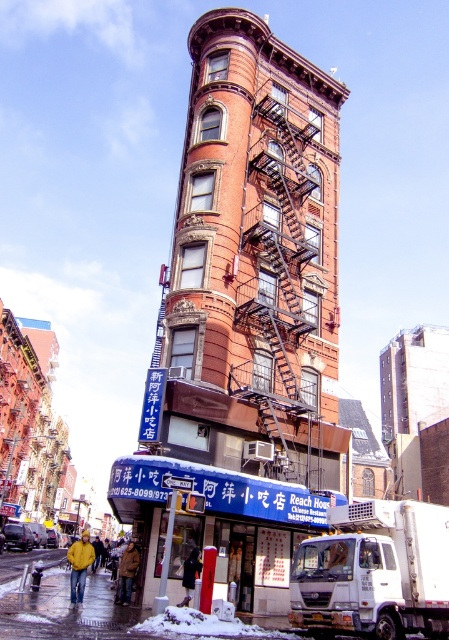
What do you see at coordinates (281, 278) in the screenshot?
I see `black metal fire escape at center` at bounding box center [281, 278].

What are the coordinates of `black metal fire escape at center` in the screenshot? It's located at (281, 278).

Is point (198, 195) closer to viewer compared to point (374, 554)?

No, it is not.

Who is more forward, (260, 96) or (387, 548)?

Point (387, 548) is more forward.

Between point (176, 554) and point (444, 531), which one is positioned in front?

Point (444, 531) is more forward.

Where is `rusty metal fire escape at center`? This screenshot has width=449, height=640. rusty metal fire escape at center is located at coordinates (245, 321).

Which is below, rusty metal fire escape at center or black metal fire escape at center?

rusty metal fire escape at center

Between rusty metal fire escape at center and black metal fire escape at center, which one has more height?

With more height is rusty metal fire escape at center.

Is point (315, 412) positioned before point (272, 248)?

Yes, it is in front of point (272, 248).

Locate an element on the screen. This screenshot has height=640, width=449. rusty metal fire escape at center is located at coordinates (245, 321).